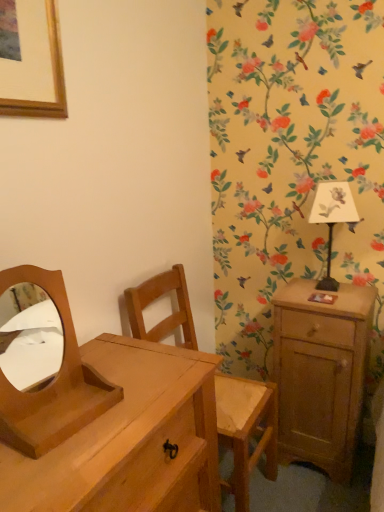
In order to click on free spot above light brown wood nightstand at right (from a real-world perspective) in this screenshot , I will do `click(317, 293)`.